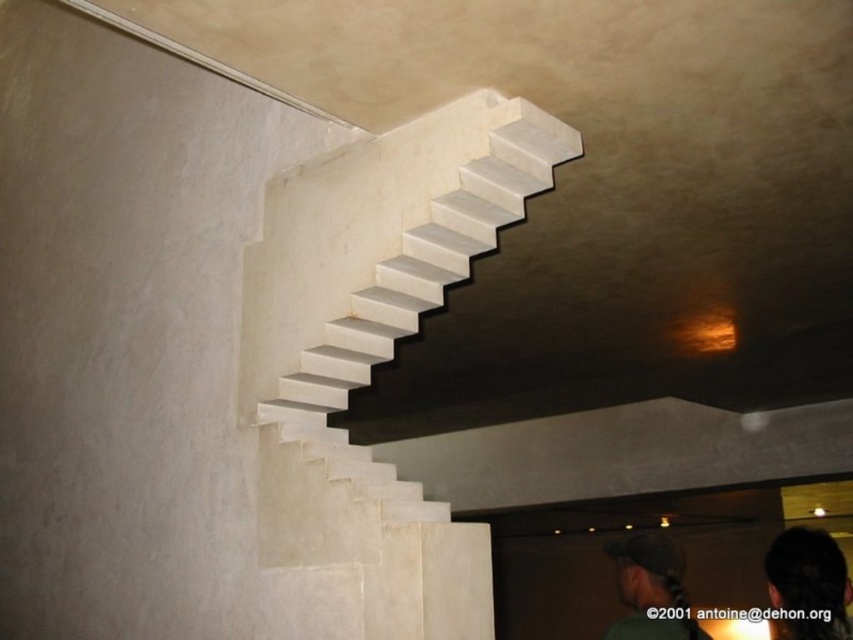
Between dark hair at lower right and dark green fabric cap at upper center, which one has less height?

Standing shorter between the two is dark hair at lower right.

Locate an element on the screen. dark hair at lower right is located at coordinates (807, 586).

This screenshot has width=853, height=640. In order to click on dark hair at lower right in this screenshot , I will do `click(807, 586)`.

Who is positioned more to the right, white marble stairs at upper center or dark green fabric cap at upper center?

dark green fabric cap at upper center is more to the right.

Does point (416, 486) come in front of point (647, 604)?

Yes.

Does point (332, 516) come farther from viewer compared to point (631, 605)?

No, (332, 516) is in front of (631, 605).

You are a GUI agent. You are given a task and a screenshot of the screen. Output one action in this format:
    pyautogui.click(x=<x>, y=<y>)
    Task: Click on the white marble stairs at upper center
    The height and width of the screenshot is (640, 853).
    Given the screenshot: What is the action you would take?
    pyautogui.click(x=378, y=346)

Is point (479, 90) in front of point (824, 573)?

Yes, it is.

The image size is (853, 640). I want to click on white marble stairs at upper center, so click(378, 346).